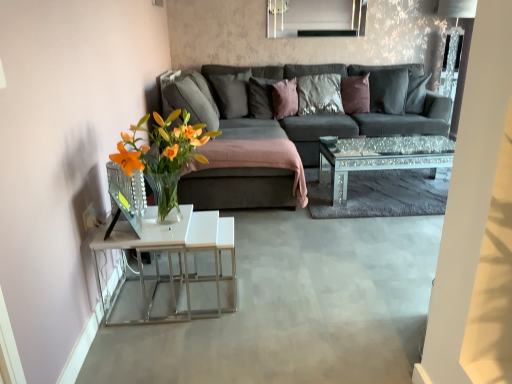
Question: Which direction should I rotate to face purple velvet pillow at center, which is counted as the third pillow, starting from the right, — up or down?

Choices:
 (A) up
 (B) down

Answer: (A)

Question: Does purple velvet pillow at center, which is the third pillow from left to right, appear on the right side of satin brown pillow at center, the fourth pillow positioned from the right?

Choices:
 (A) yes
 (B) no

Answer: (A)

Question: Considering the relative sizes of purple velvet pillow at center, which is counted as the third pillow, starting from the right, and satin brown pillow at center, the fourth pillow positioned from the right, in the image provided, is purple velvet pillow at center, which is counted as the third pillow, starting from the right, taller than satin brown pillow at center, the fourth pillow positioned from the right,?

Choices:
 (A) no
 (B) yes

Answer: (A)

Question: Does purple velvet pillow at center, which is counted as the third pillow, starting from the right, appear on the left side of satin brown pillow at center, the fourth pillow positioned from the right?

Choices:
 (A) no
 (B) yes

Answer: (A)

Question: Is purple velvet pillow at center, which is the third pillow from left to right, smaller than satin brown pillow at center, the fourth pillow positioned from the right?

Choices:
 (A) no
 (B) yes

Answer: (B)

Question: Does purple velvet pillow at center, which is counted as the third pillow, starting from the right, lie behind satin brown pillow at center, the fourth pillow positioned from the right?

Choices:
 (A) yes
 (B) no

Answer: (B)

Question: From a real-world perspective, is purple velvet pillow at center, which is the third pillow from left to right, physically below satin brown pillow at center, marked as the second pillow in a left-to-right arrangement?

Choices:
 (A) yes
 (B) no

Answer: (A)

Question: Can you confirm if matte gray pillow at center, the fifth pillow from the right, is wider than velvet brown pillow at center, which is the 4th pillow in left-to-right order?

Choices:
 (A) yes
 (B) no

Answer: (A)

Question: From the image's perspective, is matte gray pillow at center, the fifth pillow from the right, on top of velvet brown pillow at center, which is the 4th pillow in left-to-right order?

Choices:
 (A) no
 (B) yes

Answer: (A)

Question: Is matte gray pillow at center, acting as the first pillow starting from the left, further to the viewer compared to velvet brown pillow at center, the second pillow when ordered from right to left?

Choices:
 (A) no
 (B) yes

Answer: (A)

Question: Considering the relative sizes of matte gray pillow at center, the fifth pillow from the right, and velvet brown pillow at center, which is the 4th pillow in left-to-right order, in the image provided, is matte gray pillow at center, the fifth pillow from the right, thinner than velvet brown pillow at center, which is the 4th pillow in left-to-right order,?

Choices:
 (A) yes
 (B) no

Answer: (B)

Question: Does matte gray pillow at center, the fifth pillow from the right, have a larger size compared to velvet brown pillow at center, which is the 4th pillow in left-to-right order?

Choices:
 (A) yes
 (B) no

Answer: (A)

Question: Is matte gray pillow at center, the fifth pillow from the right, closer to the viewer compared to velvet brown pillow at center, which is the 4th pillow in left-to-right order?

Choices:
 (A) yes
 (B) no

Answer: (A)

Question: Does velvet brown pillow at center, the second pillow when ordered from right to left, have a lesser width compared to sparkly glass coffee table at center?

Choices:
 (A) no
 (B) yes

Answer: (B)